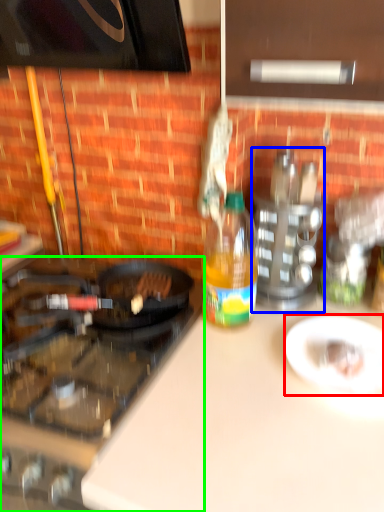
Question: Estimate the real-world distances between objects in this image. Which object is closer to plate (highlighted by a red box), appliance (highlighted by a blue box) or gas stove (highlighted by a green box)?

Choices:
 (A) appliance
 (B) gas stove

Answer: (A)